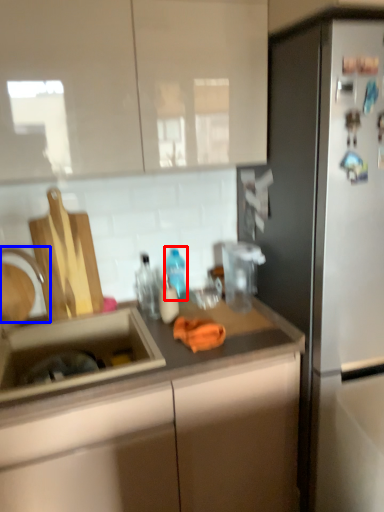
Question: Which of the following is the closest to the observer, bottle (highlighted by a red box) or faucet (highlighted by a blue box)?

Choices:
 (A) bottle
 (B) faucet

Answer: (B)